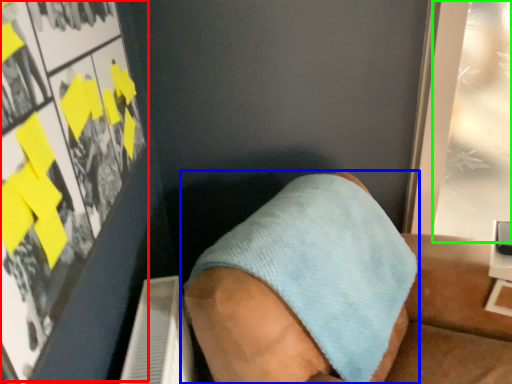
Question: Which object is positioned farthest from poster page (highlighted by a red box)? Select from footwear (highlighted by a blue box) and poster page (highlighted by a green box).

Choices:
 (A) footwear
 (B) poster page

Answer: (B)